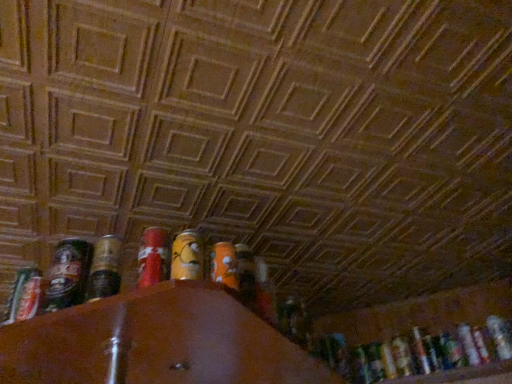
Question: Is the depth of shiny metallic can at left, which is the sixth beer in back-to-front order, less than that of metallic silver can at lower right, the third beer when ordered from front to back?

Choices:
 (A) no
 (B) yes

Answer: (B)

Question: From a real-world perspective, is shiny metallic can at left, the 6th beer from the right, beneath metallic silver can at lower right, which ranks as the fifth beer in left-to-right order?

Choices:
 (A) no
 (B) yes

Answer: (A)

Question: Is shiny metallic can at left, the 6th beer from the right, next to metallic silver can at lower right, which appears as the second beer when viewed from the right, and touching it?

Choices:
 (A) no
 (B) yes

Answer: (A)

Question: Is shiny metallic can at left, the 6th beer from the right, outside of metallic silver can at lower right, which appears as the second beer when viewed from the right?

Choices:
 (A) no
 (B) yes

Answer: (B)

Question: Can you confirm if shiny metallic can at left, which is the sixth beer in back-to-front order, is shorter than metallic silver can at lower right, marked as the fourth beer in a back-to-front arrangement?

Choices:
 (A) yes
 (B) no

Answer: (B)

Question: In terms of width, does metallic silver spray can at left look wider or thinner when compared to shiny metallic can at left, which is the sixth beer in back-to-front order?

Choices:
 (A) wide
 (B) thin

Answer: (B)

Question: Is point (23, 271) positioned closer to the camera than point (84, 246)?

Choices:
 (A) farther
 (B) closer

Answer: (A)

Question: In terms of height, does metallic silver spray can at left look taller or shorter compared to shiny metallic can at left, acting as the first beer starting from the left?

Choices:
 (A) short
 (B) tall

Answer: (A)

Question: Considering their positions, is metallic silver spray can at left located in front of or behind shiny metallic can at left, the first beer positioned from the front?

Choices:
 (A) behind
 (B) front

Answer: (A)

Question: From a real-world perspective, relative to metallic silver spray can at left, is translucent plastic bottle at lower right, the second beer from the front, vertically above or below?

Choices:
 (A) above
 (B) below

Answer: (A)

Question: In terms of size, does translucent plastic bottle at lower right, the second beer from the front, appear bigger or smaller than metallic silver spray can at left?

Choices:
 (A) big
 (B) small

Answer: (A)

Question: From their relative heights in the image, would you say translucent plastic bottle at lower right, the 5th beer in the back-to-front sequence, is taller or shorter than metallic silver spray can at left?

Choices:
 (A) short
 (B) tall

Answer: (B)

Question: From the image's perspective, relative to metallic silver spray can at left, is translucent plastic bottle at lower right, the second beer from the front, above or below?

Choices:
 (A) below
 (B) above

Answer: (A)

Question: In terms of height, does metallic silver can at lower right, which appears as the 3th beer when viewed from the left, look taller or shorter compared to shiny metallic can at left, the first beer positioned from the front?

Choices:
 (A) short
 (B) tall

Answer: (B)

Question: Is point (415, 327) positioned closer to the camera than point (57, 281)?

Choices:
 (A) closer
 (B) farther

Answer: (B)